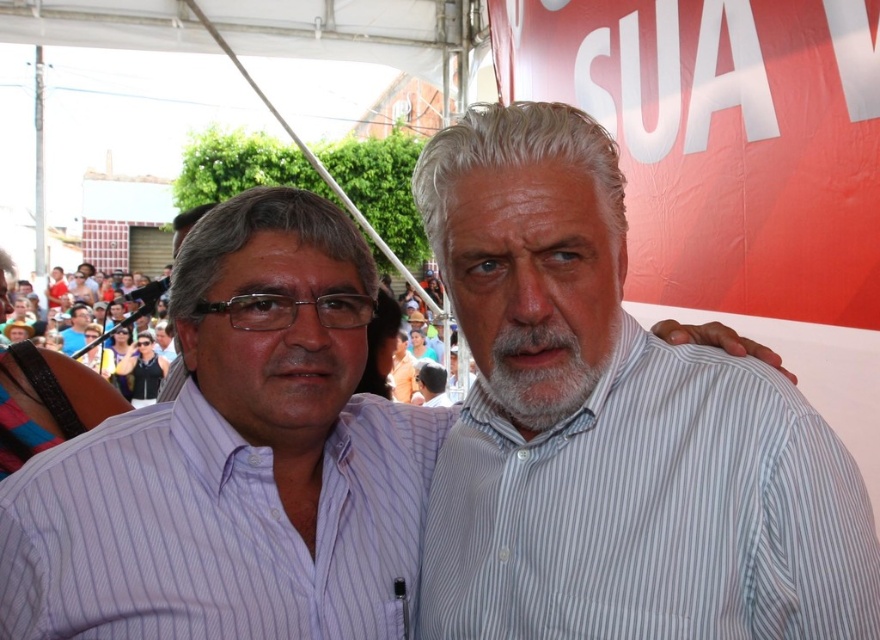
You are at an outdoor event and notice two men wearing striped shirts standing under a tent. The men are positioned such that their shirts are both at the center of your view. Which shirt, the white striped shirt at center or the purple striped shirt at center, is positioned to the left?

The white striped shirt at center is positioned to the left of the purple striped shirt at center.

You are a photographer at the event and want to focus on the two points in the image. Which point, point (11, 595) or point (160, 509), is closer to your camera?

Point (11, 595) is closer to the camera than point (160, 509).